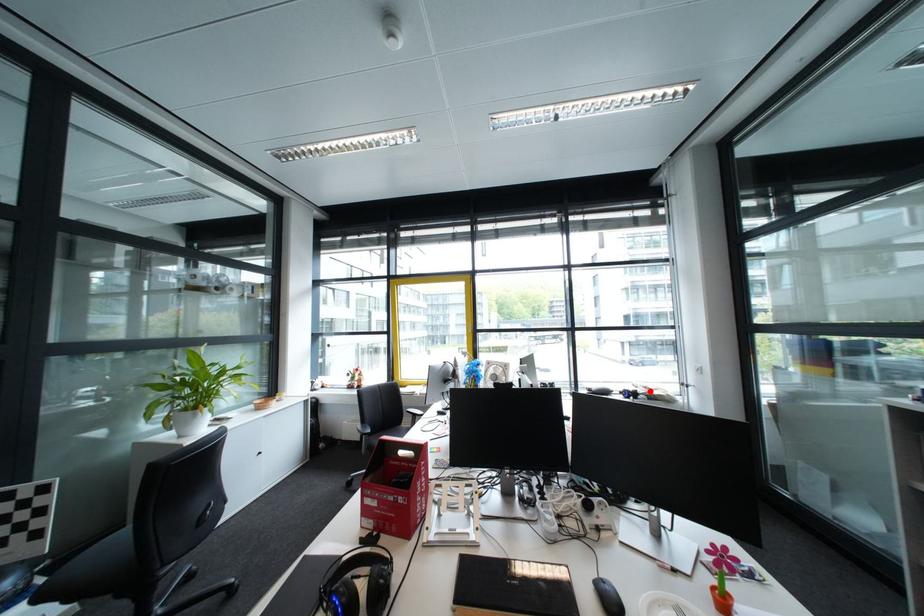
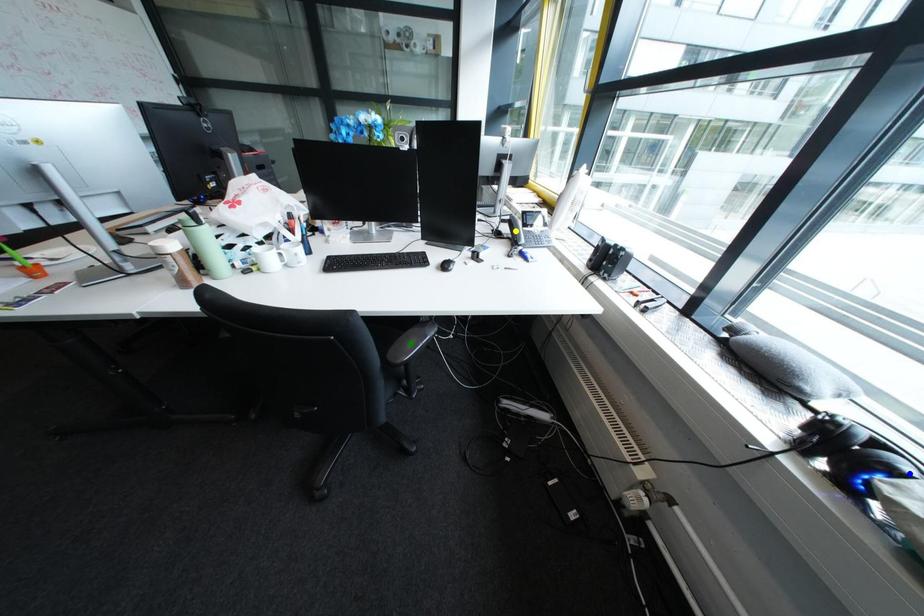
Question: I am providing you with two images of the same scene from different viewpoints. A red point is marked on the first image. You are given multiple points on the second image. In image 2, which mark is for the same physical point as the one in image 1?

Choices:
 (A) green point
 (B) blue point
 (C) yellow point

Answer: (B)